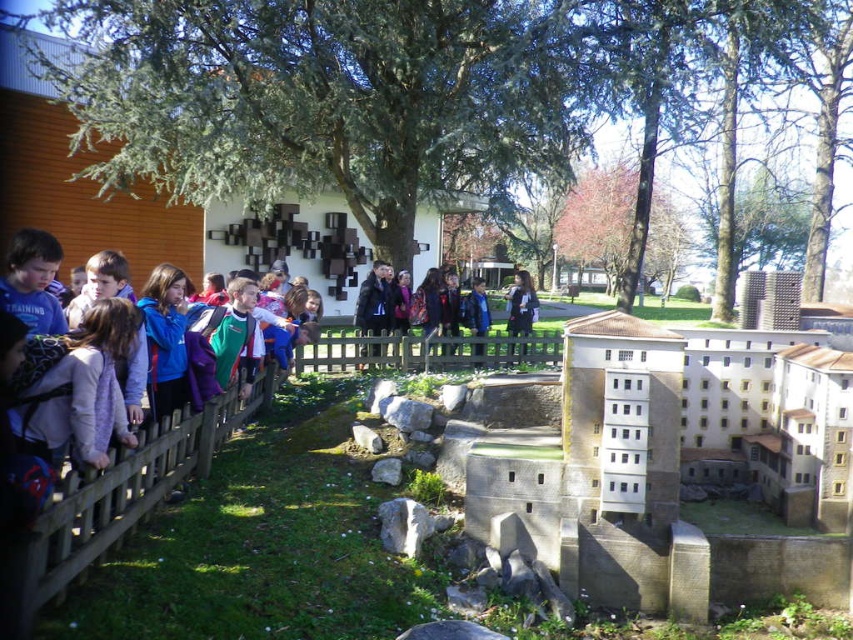
Question: Can you confirm if brown wooden fence at left is positioned to the left of brown wooden fence at center?

Choices:
 (A) yes
 (B) no

Answer: (A)

Question: Which point is closer to the camera?

Choices:
 (A) (556, 340)
 (B) (264, 388)

Answer: (B)

Question: Is brown wooden fence at left wider than brown wooden fence at center?

Choices:
 (A) no
 (B) yes

Answer: (A)

Question: Which point is farther to the camera?

Choices:
 (A) (543, 333)
 (B) (207, 404)

Answer: (A)

Question: Can you confirm if brown wooden fence at left is thinner than brown wooden fence at center?

Choices:
 (A) no
 (B) yes

Answer: (B)